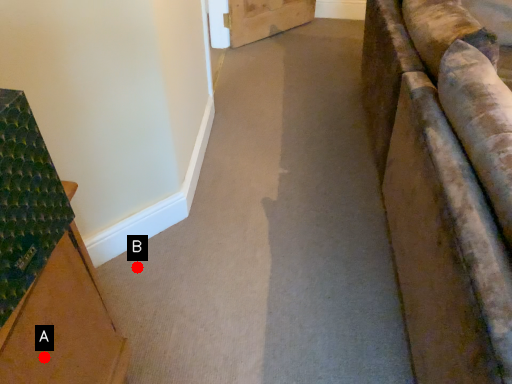
Question: Two points are circled on the image, labeled by A and B beside each circle. Which point appears farthest from the camera in this image?

Choices:
 (A) A is further
 (B) B is further

Answer: (B)